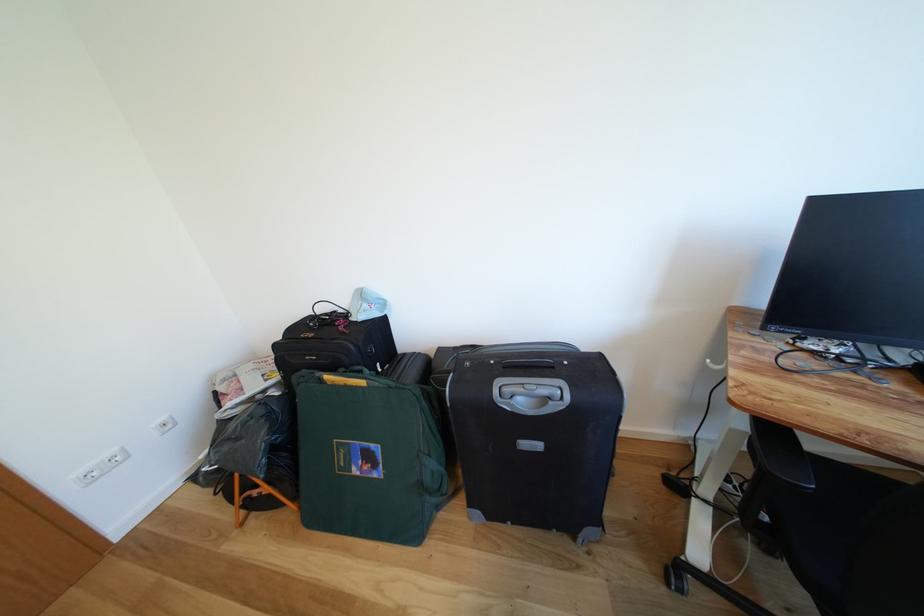
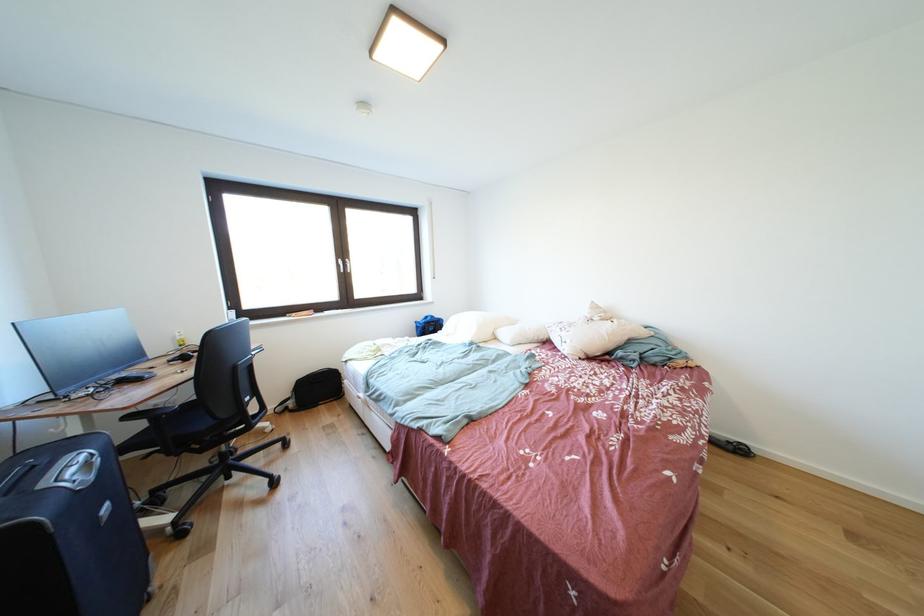
Where in the second image is the point corresponding to (x=739, y=407) from the first image?

(134, 413)